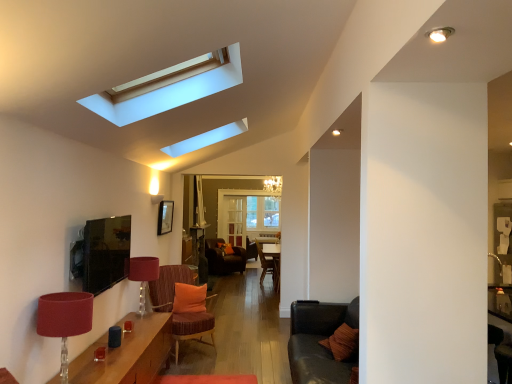
Identify the location of velvet orange chair at center. This screenshot has height=384, width=512. coord(168,286).

This screenshot has height=384, width=512. What do you see at coordinates (64, 320) in the screenshot? I see `matte red lampshade at lower left, which appears as the 2th lamp when viewed from the back` at bounding box center [64, 320].

This screenshot has width=512, height=384. Find the location of `velvet orange armchair at center`. velvet orange armchair at center is located at coordinates click(268, 266).

Describe the element at coordinates (189, 298) in the screenshot. I see `orange fabric pillow at center` at that location.

The height and width of the screenshot is (384, 512). What do you see at coordinates (319, 340) in the screenshot?
I see `textured brown couch at lower right` at bounding box center [319, 340].

I want to click on velvet orange chair at center, so click(168, 286).

Measure the distance between velvet orange armchair at center and orange fabric pillow at center.

The distance of velvet orange armchair at center from orange fabric pillow at center is 3.77 meters.

Is orange fabric pillow at center inside velvet orange armchair at center?

No, orange fabric pillow at center is not inside velvet orange armchair at center.

Considering the positions of point (277, 269) and point (200, 303), is point (277, 269) closer or farther from the camera than point (200, 303)?

Point (277, 269) is farther from the camera than point (200, 303).

Based on the photo, are velvet orange armchair at center and orange fabric pillow at center making contact?

No.

I want to click on lamp below the matte red lampshade at lower left, which ranks as the 1th lamp in back-to-front order (from a real-world perspective), so click(x=64, y=320).

Can you confirm if matte red lampshade at lower left, which ranks as the 1th lamp in back-to-front order, is taller than matte red lampshade at lower left, which appears as the 2th lamp when viewed from the back?

No, matte red lampshade at lower left, which ranks as the 1th lamp in back-to-front order, is not taller than matte red lampshade at lower left, which appears as the 2th lamp when viewed from the back.

Can you confirm if matte red lampshade at lower left, which ranks as the 1th lamp in back-to-front order, is smaller than matte red lampshade at lower left, which appears as the 2th lamp when viewed from the back?

Yes, matte red lampshade at lower left, which ranks as the 1th lamp in back-to-front order, is smaller than matte red lampshade at lower left, which appears as the 2th lamp when viewed from the back.

How much distance is there between matte red lampshade at lower left, which ranks as the 1th lamp in back-to-front order, and matte red lampshade at lower left, acting as the 1th lamp starting from the front?

matte red lampshade at lower left, which ranks as the 1th lamp in back-to-front order, is 6.79 feet from matte red lampshade at lower left, acting as the 1th lamp starting from the front.

Does orange fabric pillow at center contain wooden table at lower left?

That's incorrect, wooden table at lower left is not inside orange fabric pillow at center.

Could you tell me if orange fabric pillow at center is turned towards wooden table at lower left?

Yes, orange fabric pillow at center is facing wooden table at lower left.

What's the angular difference between orange fabric pillow at center and wooden table at lower left's facing directions?

There is a 114-degree angle between the facing directions of orange fabric pillow at center and wooden table at lower left.

Considering the positions of objects orange fabric pillow at center and wooden table at lower left in the image provided, who is in front, orange fabric pillow at center or wooden table at lower left?

wooden table at lower left.

Which of these two, wooden table at lower left or textured brown couch at lower right, is wider?

wooden table at lower left is wider.

Is wooden table at lower left behind textured brown couch at lower right?

That is False.

Which of these two, wooden table at lower left or textured brown couch at lower right, is smaller?

textured brown couch at lower right is smaller.

Does point (95, 369) appear closer or farther from the camera than point (329, 372)?

Point (95, 369) is positioned closer to the camera compared to point (329, 372).

Considering the sizes of objects matte red lampshade at lower left, acting as the 1th lamp starting from the front, and velvet orange chair at center in the image provided, who is wider, matte red lampshade at lower left, acting as the 1th lamp starting from the front, or velvet orange chair at center?

velvet orange chair at center is wider.

Considering the positions of point (63, 318) and point (164, 295), is point (63, 318) closer or farther from the camera than point (164, 295)?

Point (63, 318) appears to be closer to the viewer than point (164, 295).

Is matte red lampshade at lower left, which appears as the 2th lamp when viewed from the back, to the right of velvet orange chair at center from the viewer's perspective?

No, matte red lampshade at lower left, which appears as the 2th lamp when viewed from the back, is not to the right of velvet orange chair at center.

Could velvet orange chair at center be considered to be inside matte red lampshade at lower left, acting as the 1th lamp starting from the front?

That's incorrect, velvet orange chair at center is not inside matte red lampshade at lower left, acting as the 1th lamp starting from the front.

Considering the points (198, 296) and (70, 317), which point is in front, point (198, 296) or point (70, 317)?

The point (70, 317) is more forward.

Is orange fabric pillow at center taller than matte red lampshade at lower left, acting as the 1th lamp starting from the front?

No.

Which is behind, orange fabric pillow at center or matte red lampshade at lower left, acting as the 1th lamp starting from the front?

orange fabric pillow at center is more distant.

From the orange fabric pillow at center, count the 2nd lamp to the left and point to it. Please provide its 2D coordinates.

[(64, 320)]

Which object is positioned more to the right, velvet orange armchair at center or matte red lampshade at lower left, arranged as the second lamp when viewed from the front?

velvet orange armchair at center.

Do you think velvet orange armchair at center is within matte red lampshade at lower left, which ranks as the 1th lamp in back-to-front order, or outside of it?

velvet orange armchair at center is located beyond the bounds of matte red lampshade at lower left, which ranks as the 1th lamp in back-to-front order.

Is velvet orange armchair at center behind matte red lampshade at lower left, arranged as the second lamp when viewed from the front?

That is True.

Looking at this image, from a real-world perspective, is velvet orange armchair at center physically above matte red lampshade at lower left, arranged as the second lamp when viewed from the front?

Actually, velvet orange armchair at center is physically below matte red lampshade at lower left, arranged as the second lamp when viewed from the front, in the real world.

You are a GUI agent. You are given a task and a screenshot of the screen. Output one action in this format:
    pyautogui.click(x=<x>, y=<y>)
    Task: Click on the armchair below the orange fabric pillow at center (from a real-world perspective)
    
    Given the screenshot: What is the action you would take?
    pyautogui.click(x=268, y=266)

Locate an element on the screen. lamp on the left of matte red lampshade at lower left, arranged as the second lamp when viewed from the front is located at coordinates (64, 320).

When comparing their distances from wooden table at lower left, does matte red lampshade at lower left, which ranks as the 1th lamp in back-to-front order, or textured brown couch at lower right seem closer?

Based on the image, matte red lampshade at lower left, which ranks as the 1th lamp in back-to-front order, appears to be nearer to wooden table at lower left.

From the image, which object appears to be farther from velvet orange armchair at center, wooden table at lower left or matte red lampshade at lower left, arranged as the second lamp when viewed from the front?

wooden table at lower left.

Looking at the image, which one is located closer to velvet orange armchair at center, velvet orange chair at center or matte red lampshade at lower left, which ranks as the 1th lamp in back-to-front order?

Among the two, velvet orange chair at center is located nearer to velvet orange armchair at center.

Based on their spatial positions, is orange fabric pillow at center or velvet orange armchair at center further from matte red lampshade at lower left, acting as the 1th lamp starting from the front?

Among the two, velvet orange armchair at center is located further to matte red lampshade at lower left, acting as the 1th lamp starting from the front.

Based on their spatial positions, is orange fabric pillow at center or wooden table at lower left further from velvet orange chair at center?

wooden table at lower left.

Estimate the real-world distances between objects in this image. Which object is closer to matte red lampshade at lower left, which ranks as the 1th lamp in back-to-front order, matte red lampshade at lower left, acting as the 1th lamp starting from the front, or velvet orange armchair at center?

matte red lampshade at lower left, acting as the 1th lamp starting from the front, is closer to matte red lampshade at lower left, which ranks as the 1th lamp in back-to-front order.

Consider the image. Considering their positions, is orange fabric pillow at center positioned further to velvet orange armchair at center than velvet orange chair at center?

orange fabric pillow at center is further to velvet orange armchair at center.

Consider the image. From the image, which object appears to be nearer to wooden table at lower left, matte red lampshade at lower left, acting as the 1th lamp starting from the front, or velvet orange armchair at center?

matte red lampshade at lower left, acting as the 1th lamp starting from the front, is positioned closer to the anchor wooden table at lower left.

Where is `pillow between wooden table at lower left and velvet orange armchair at center in the front-back direction`? pillow between wooden table at lower left and velvet orange armchair at center in the front-back direction is located at coordinates (189, 298).

Find the location of `pillow located between matte red lampshade at lower left, arranged as the second lamp when viewed from the front, and velvet orange armchair at center in the depth direction`. pillow located between matte red lampshade at lower left, arranged as the second lamp when viewed from the front, and velvet orange armchair at center in the depth direction is located at coordinates (189, 298).

Image resolution: width=512 pixels, height=384 pixels. In order to click on chair between textured brown couch at lower right and velvet orange armchair at center from front to back in this screenshot , I will do `click(168, 286)`.

Identify the location of chair between matte red lampshade at lower left, which ranks as the 1th lamp in back-to-front order, and orange fabric pillow at center, along the z-axis. (168, 286).